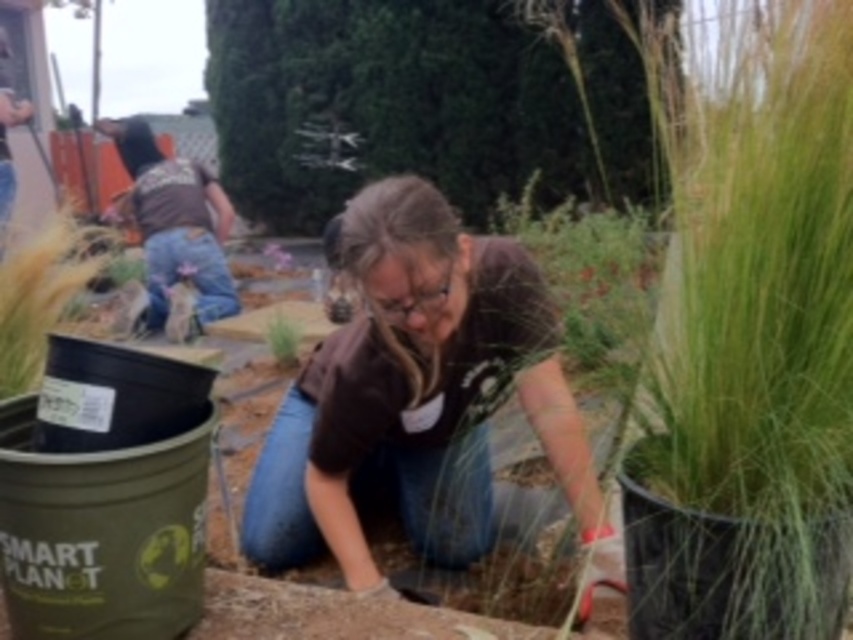
Is brown cotton shirt at center further to camera compared to green matte plant at center?

That is False.

Can you confirm if brown cotton shirt at center is thinner than green matte plant at center?

No, brown cotton shirt at center is not thinner than green matte plant at center.

Is point (364, 216) positioned behind point (271, 314)?

No, (364, 216) is in front of (271, 314).

You are a GUI agent. You are given a task and a screenshot of the screen. Output one action in this format:
    pyautogui.click(x=<x>, y=<y>)
    Task: Click on the brown cotton shirt at center
    
    Given the screenshot: What is the action you would take?
    tap(415, 394)